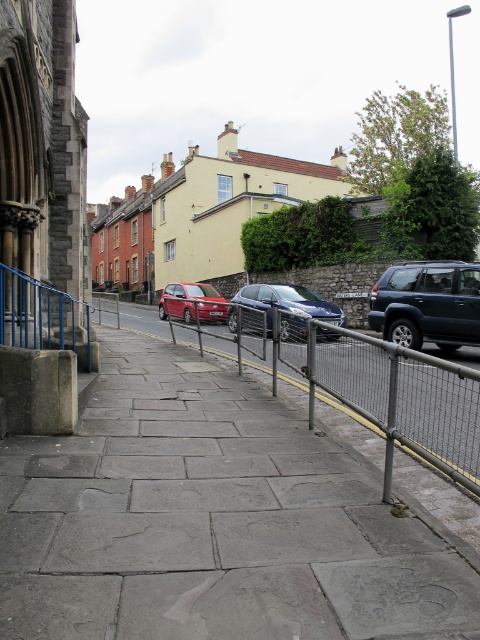
You are standing on the sidewalk in the residential area. You see a metal mesh fence at center represented by point (375, 388). Is the fence closer to the road or the building?

The metal mesh fence at center is represented by point (375, 388), which is closer to the road than the building.

You are a delivery person trying to deliver a package to the building on the left. You need to cross the gray stone pavement at center and go around the metal mesh fence at center. Which obstacle will you have to go over or under?

The gray stone pavement at center is shorter than the metal mesh fence at center, so you will have to go over the gray stone pavement at center and under the metal mesh fence at center.

You are standing at the camera position and want to walk to the point with coordinates point (289, 288) and point (220, 305). Which point is closer to you?

Point (289, 288) is closer to the camera than point (220, 305), so you will reach point (289, 288) first.